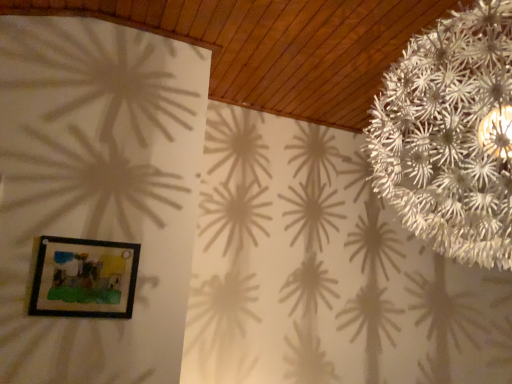
Describe the element at coordinates (451, 136) in the screenshot. I see `white paper flower at upper right` at that location.

This screenshot has height=384, width=512. In order to click on white paper flower at upper right in this screenshot , I will do `click(451, 136)`.

What do you see at coordinates (84, 278) in the screenshot? I see `wooden framed picture at lower left` at bounding box center [84, 278].

Identify the location of wooden framed picture at lower left. The image size is (512, 384). (84, 278).

I want to click on white paper flower at upper right, so click(x=451, y=136).

Visually, is white paper flower at upper right positioned to the left or to the right of wooden framed picture at lower left?

white paper flower at upper right is to the right of wooden framed picture at lower left.

Which object is further away from the camera, white paper flower at upper right or wooden framed picture at lower left?

wooden framed picture at lower left is more distant.

Does point (489, 151) lie behind point (120, 269)?

No, it is in front of (120, 269).

From the image's perspective, which one is positioned lower, white paper flower at upper right or wooden framed picture at lower left?

wooden framed picture at lower left, from the image's perspective.

From a real-world perspective, is white paper flower at upper right beneath wooden framed picture at lower left?

No, from a real-world perspective, white paper flower at upper right is not below wooden framed picture at lower left.

In the scene shown: In terms of width, does white paper flower at upper right look wider or thinner when compared to wooden framed picture at lower left?

Clearly, white paper flower at upper right has more width compared to wooden framed picture at lower left.

Does white paper flower at upper right have a lesser height compared to wooden framed picture at lower left?

No, white paper flower at upper right is not shorter than wooden framed picture at lower left.

Who is bigger, white paper flower at upper right or wooden framed picture at lower left?

white paper flower at upper right is bigger.

Would you say wooden framed picture at lower left is part of white paper flower at upper right's contents?

No, white paper flower at upper right does not contain wooden framed picture at lower left.

From the picture: Is white paper flower at upper right not close to wooden framed picture at lower left?

white paper flower at upper right is far away from wooden framed picture at lower left.

Is white paper flower at upper right oriented towards wooden framed picture at lower left?

No, white paper flower at upper right is not oriented towards wooden framed picture at lower left.

What's the angular difference between white paper flower at upper right and wooden framed picture at lower left's facing directions?

90.1 degrees separate the facing orientations of white paper flower at upper right and wooden framed picture at lower left.

Where is `flower located above the wooden framed picture at lower left (from a real-world perspective)`? flower located above the wooden framed picture at lower left (from a real-world perspective) is located at coordinates (451, 136).

Can you confirm if wooden framed picture at lower left is positioned to the left of white paper flower at upper right?

Yes.

Considering their positions, is wooden framed picture at lower left located in front of or behind white paper flower at upper right?

Visually, wooden framed picture at lower left is located behind white paper flower at upper right.

Which is farther from the camera, (x=35, y=313) or (x=463, y=241)?

The point (x=35, y=313) is more distant.

From the image's perspective, which one is positioned higher, wooden framed picture at lower left or white paper flower at upper right?

white paper flower at upper right is shown above in the image.

From a real-world perspective, which is physically above, wooden framed picture at lower left or white paper flower at upper right?

From a 3D spatial view, white paper flower at upper right is above.

Which object is wider, wooden framed picture at lower left or white paper flower at upper right?

With larger width is white paper flower at upper right.

Does wooden framed picture at lower left have a greater height compared to white paper flower at upper right?

No.

Who is bigger, wooden framed picture at lower left or white paper flower at upper right?

white paper flower at upper right is bigger.

Based on the photo, is wooden framed picture at lower left outside of white paper flower at upper right?

Yes, wooden framed picture at lower left is not within white paper flower at upper right.

Consider the image. Is wooden framed picture at lower left positioned far away from white paper flower at upper right?

Yes, wooden framed picture at lower left and white paper flower at upper right are quite far apart.

From the picture: Could you tell me if wooden framed picture at lower left is turned towards white paper flower at upper right?

No, wooden framed picture at lower left is not facing towards white paper flower at upper right.

In the image, there is a white paper flower at upper right. Where is `picture frame below it (from the image's perspective)`? picture frame below it (from the image's perspective) is located at coordinates (84, 278).

Identify the location of flower above the wooden framed picture at lower left (from a real-world perspective). [451, 136].

Identify the location of picture frame located below the white paper flower at upper right (from the image's perspective). (84, 278).